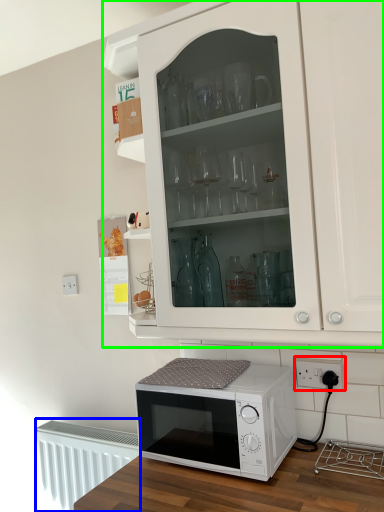
Question: Which is nearer to the electric outlet (highlighted by a red box)? radiator (highlighted by a blue box) or cabinetry (highlighted by a green box).

Choices:
 (A) radiator
 (B) cabinetry

Answer: (B)